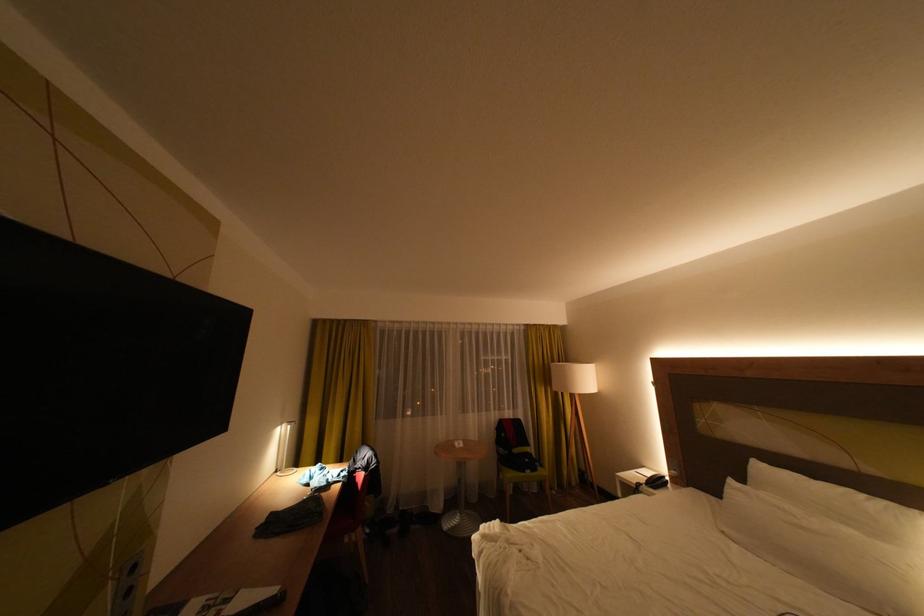
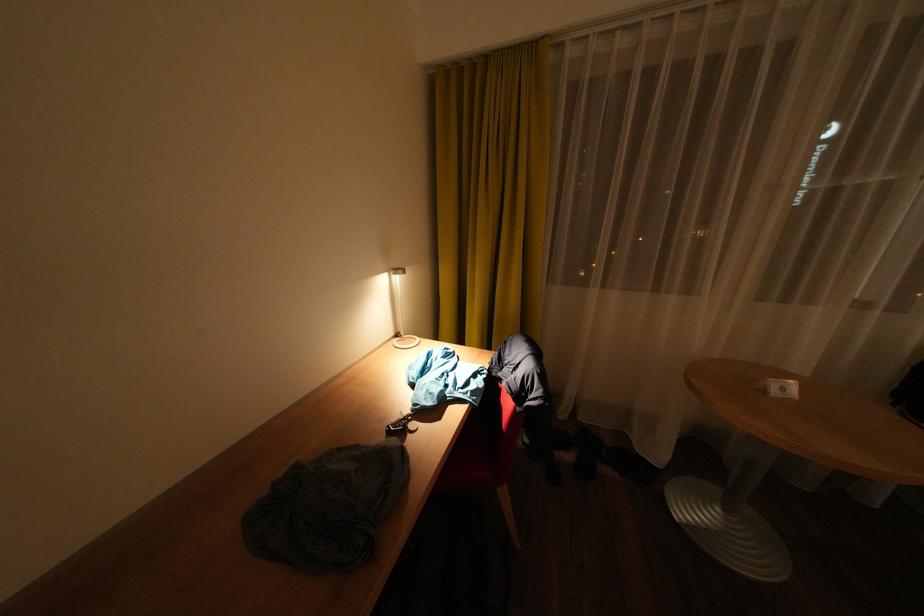
Where in the second image is the point corresponding to [377,323] from the first image?

(544, 47)